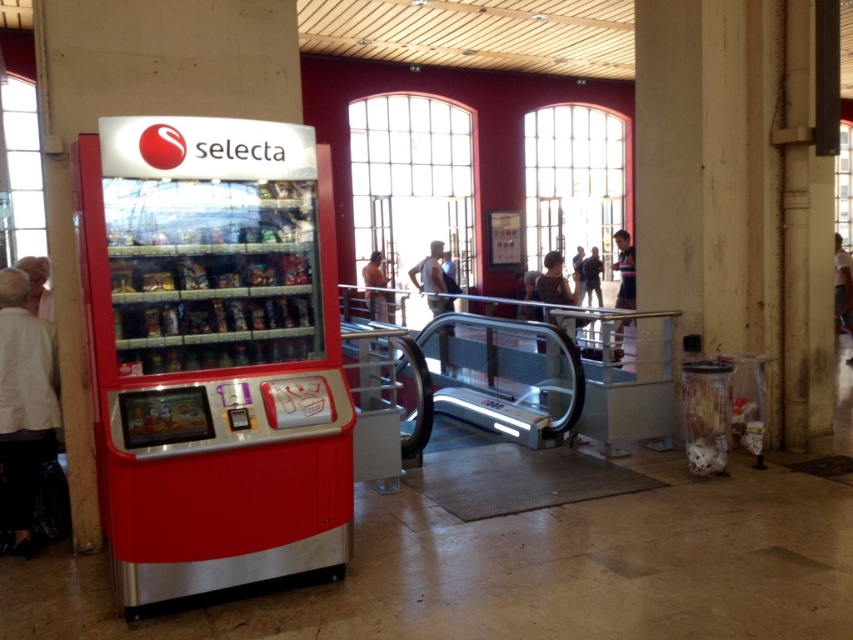
Question: Is metallic red vending machine at left below brown leather jacket at upper center?

Choices:
 (A) no
 (B) yes

Answer: (B)

Question: Which point appears farthest from the camera in this image?

Choices:
 (A) (190, 198)
 (B) (49, 300)

Answer: (B)

Question: Which point appears farthest from the camera in this image?

Choices:
 (A) (42, 316)
 (B) (445, 298)

Answer: (B)

Question: Can you confirm if metallic red vending machine at left is positioned to the right of smooth skin person at center?

Choices:
 (A) no
 (B) yes

Answer: (A)

Question: Where is smooth skin person at center located in relation to dark blue jeans at center in the image?

Choices:
 (A) left
 (B) right

Answer: (B)

Question: Which object appears farthest from the camera in this image?

Choices:
 (A) blue fabric shirt at center
 (B) brown leather jacket at upper center
 (C) white fabric person at left
 (D) smooth skin person at center

Answer: (A)